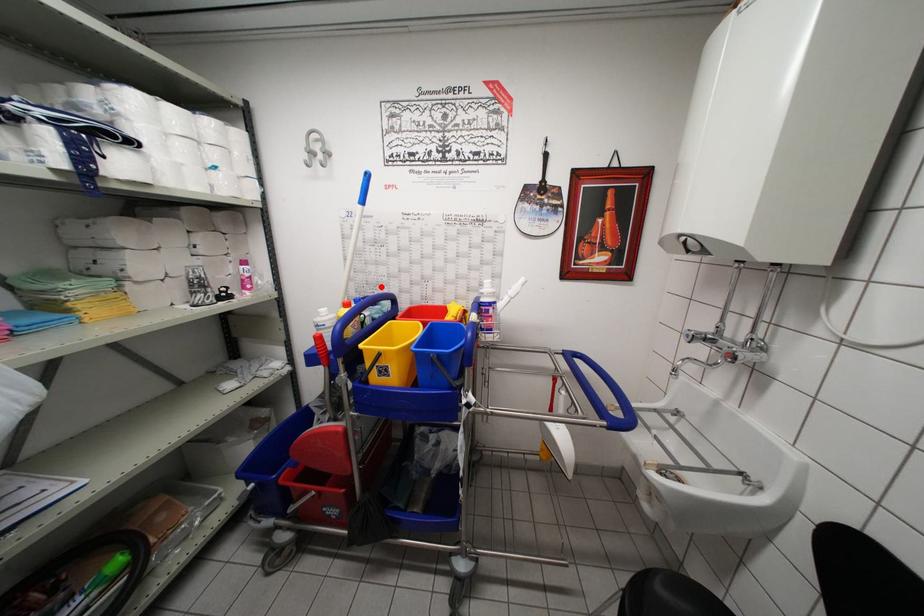
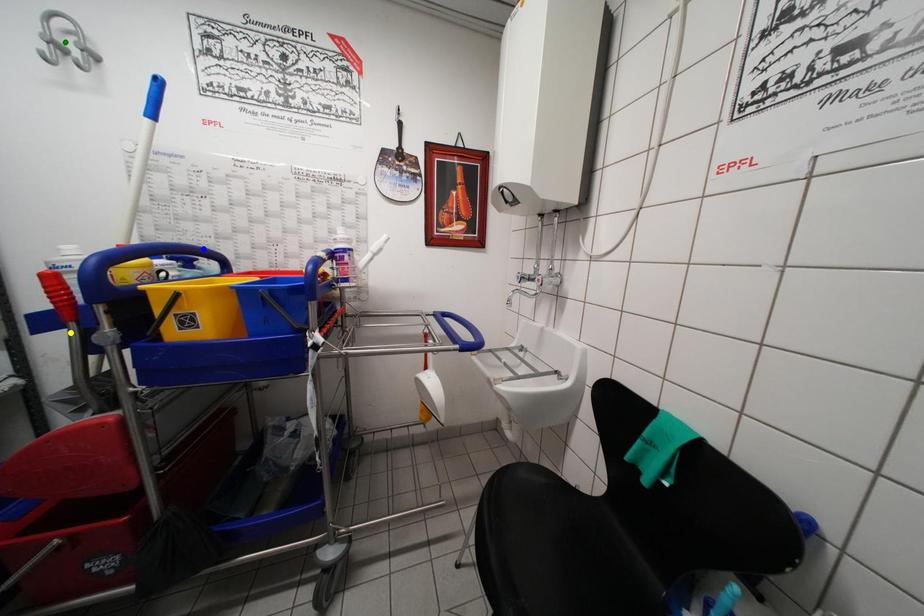
Question: I am providing you with two images of the same scene from different viewpoints. A red point is marked on the first image. You are given multiple points on the second image. Which point in image 2 is actually the same real-world point as the red point in image 1?

Choices:
 (A) green point
 (B) yellow point
 (C) blue point

Answer: (C)